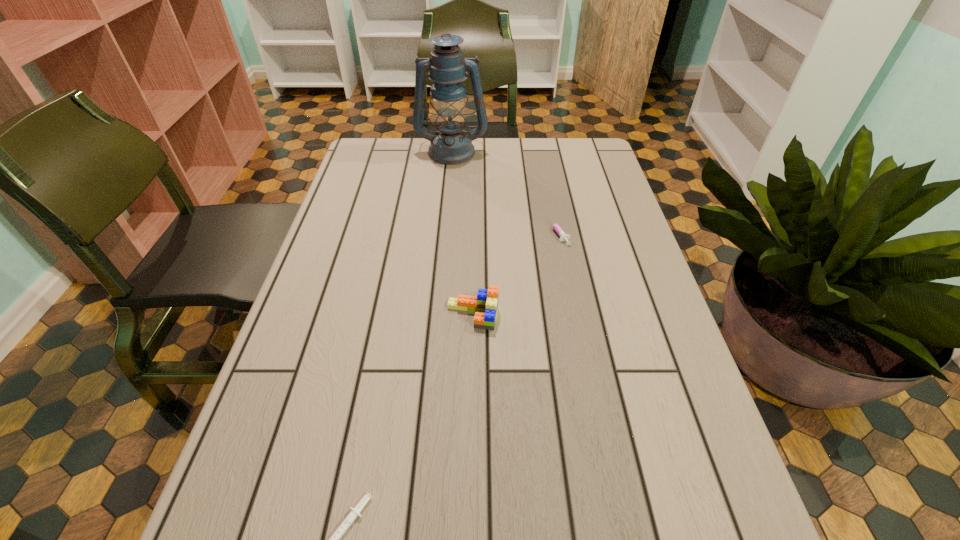
Find the location of a particular element. the tallest object is located at coordinates (450, 145).

Find the location of a particular element. lantern is located at coordinates click(450, 145).

You are a GUI agent. You are given a task and a screenshot of the screen. Output one action in this format:
    pyautogui.click(x=<x>, y=<y>)
    Task: Click on the third shortest object
    The image size is (960, 540).
    Given the screenshot: What is the action you would take?
    pyautogui.click(x=485, y=305)

Locate an element on the screen. This screenshot has width=960, height=540. the second nearest object is located at coordinates (485, 305).

Where is `the taller syringe`? The height and width of the screenshot is (540, 960). the taller syringe is located at coordinates (563, 237).

Where is `the farther syringe`? the farther syringe is located at coordinates (563, 237).

Locate an element on the screen. vacant position located 0.170m on the front-facing side of the tallest object is located at coordinates (447, 196).

You are a GUI agent. You are given a task and a screenshot of the screen. Output one action in this format:
    pyautogui.click(x=<x>, y=<y>)
    Task: Click on the free space located on the right of the Lego
    The image size is (960, 540).
    Given the screenshot: What is the action you would take?
    pyautogui.click(x=582, y=315)

Identify the location of free region located on the front of the third tallest object. The width and height of the screenshot is (960, 540). (567, 277).

Locate an element on the screen. object present at the far edge is located at coordinates (450, 145).